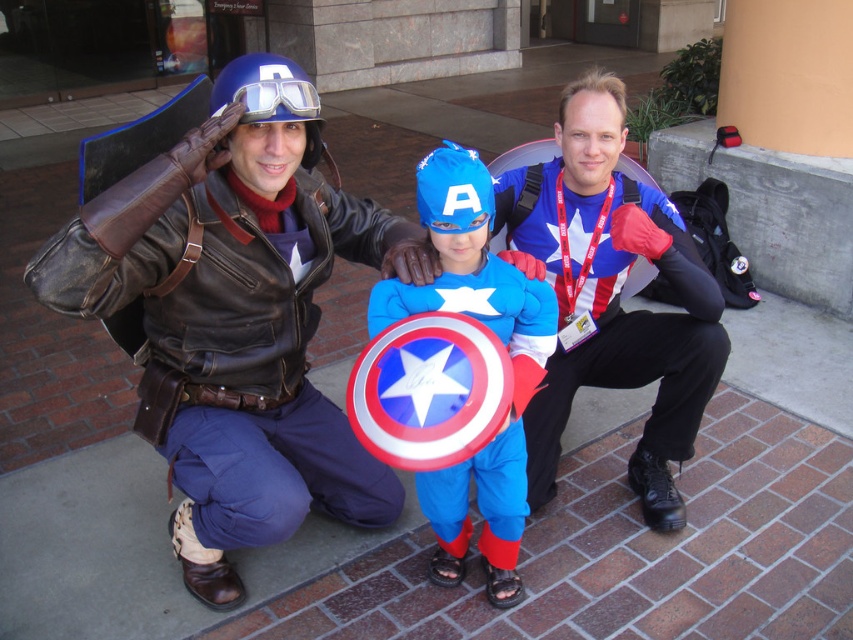
Measure the distance between point [465,540] and camera.

A distance of 2.18 meters exists between point [465,540] and camera.

The image size is (853, 640). Describe the element at coordinates (506, 348) in the screenshot. I see `shiny blue costume at center` at that location.

Where is `shiny blue costume at center`? The image size is (853, 640). shiny blue costume at center is located at coordinates (506, 348).

Based on the photo, which of these two, blue matte helmet at upper center or blue matte helmet at center, stands shorter?

blue matte helmet at upper center is shorter.

You are a GUI agent. You are given a task and a screenshot of the screen. Output one action in this format:
    pyautogui.click(x=<x>, y=<y>)
    Task: Click on the blue matte helmet at upper center
    
    Given the screenshot: What is the action you would take?
    pyautogui.click(x=273, y=99)

Identify the location of blue matte helmet at upper center. (273, 99).

You are a GUI agent. You are given a task and a screenshot of the screen. Output one action in this format:
    pyautogui.click(x=<x>, y=<y>)
    Task: Click on the leather jacket at left
    The width and height of the screenshot is (853, 640).
    Given the screenshot: What is the action you would take?
    [236, 316]